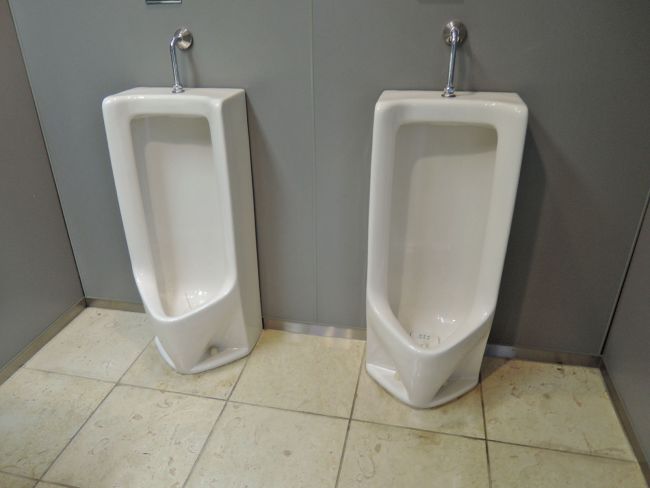
Locate an element on the screen. floor is located at coordinates (212, 410).